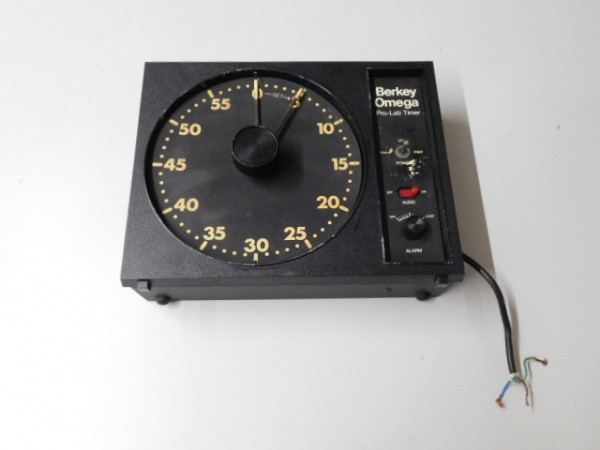
This screenshot has height=450, width=600. Identify the location of knob. (411, 230).